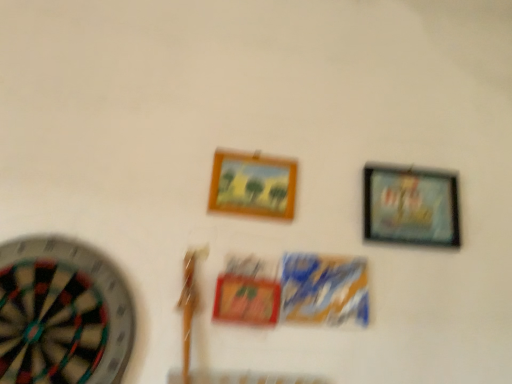
Question: Is wooden frame at center, which is counted as the first picture frame, starting from the left, placed right next to metallic silver picture frame at upper right, the 2th picture frame positioned from the left?

Choices:
 (A) no
 (B) yes

Answer: (A)

Question: Can you confirm if wooden frame at center, which is the second picture frame from right to left, is positioned to the left of metallic silver picture frame at upper right, the 1th picture frame positioned from the right?

Choices:
 (A) yes
 (B) no

Answer: (A)

Question: From a real-world perspective, is wooden frame at center, which is the second picture frame from right to left, located higher than metallic silver picture frame at upper right, the 2th picture frame positioned from the left?

Choices:
 (A) no
 (B) yes

Answer: (B)

Question: Does wooden frame at center, which is counted as the first picture frame, starting from the left, have a smaller size compared to metallic silver picture frame at upper right, the 1th picture frame positioned from the right?

Choices:
 (A) yes
 (B) no

Answer: (A)

Question: Is wooden frame at center, which is the second picture frame from right to left, in front of metallic silver picture frame at upper right, the 1th picture frame positioned from the right?

Choices:
 (A) no
 (B) yes

Answer: (B)

Question: Is metallic silver picture frame at upper right, the 1th picture frame positioned from the right, spatially inside wooden frame at center, which is counted as the first picture frame, starting from the left, or outside of it?

Choices:
 (A) outside
 (B) inside

Answer: (A)

Question: Does point (415, 193) appear closer or farther from the camera than point (269, 188)?

Choices:
 (A) closer
 (B) farther

Answer: (B)

Question: From the image's perspective, is metallic silver picture frame at upper right, the 2th picture frame positioned from the left, above or below wooden frame at center, which is counted as the first picture frame, starting from the left?

Choices:
 (A) below
 (B) above

Answer: (A)

Question: In terms of height, does metallic silver picture frame at upper right, the 2th picture frame positioned from the left, look taller or shorter compared to wooden frame at center, which is counted as the first picture frame, starting from the left?

Choices:
 (A) tall
 (B) short

Answer: (A)

Question: From a real-world perspective, is multicolored felt dartboard at left above or below wooden frame at center, which is the second picture frame from right to left?

Choices:
 (A) below
 (B) above

Answer: (A)

Question: Is point (78, 329) closer or farther from the camera than point (215, 178)?

Choices:
 (A) farther
 (B) closer

Answer: (B)

Question: Is multicolored felt dartboard at left taller or shorter than wooden frame at center, which is the second picture frame from right to left?

Choices:
 (A) short
 (B) tall

Answer: (B)

Question: From the image's perspective, relative to wooden frame at center, which is counted as the first picture frame, starting from the left, is multicolored felt dartboard at left above or below?

Choices:
 (A) below
 (B) above

Answer: (A)

Question: Considering the positions of wooden frame at center, which is counted as the first picture frame, starting from the left, and multicolored felt dartboard at left in the image, is wooden frame at center, which is counted as the first picture frame, starting from the left, bigger or smaller than multicolored felt dartboard at left?

Choices:
 (A) big
 (B) small

Answer: (B)

Question: Is point (217, 160) closer or farther from the camera than point (37, 259)?

Choices:
 (A) closer
 (B) farther

Answer: (B)